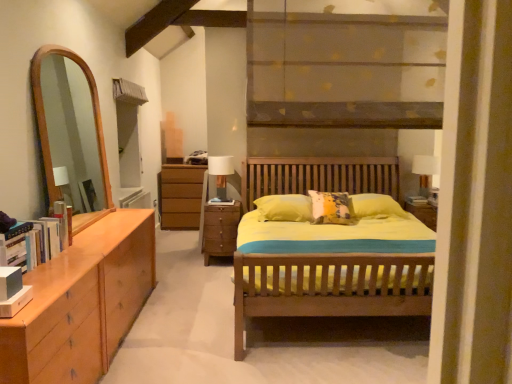
Describe the element at coordinates (220, 230) in the screenshot. The image size is (512, 384). I see `brown wooden chest of drawers at center` at that location.

Image resolution: width=512 pixels, height=384 pixels. Identify the location of brown wooden chest of drawers at center. (220, 230).

Can you tell me how much brown wooden chest of drawers at center and matte white table lamp at center, arranged as the second table lamp when viewed from the right, differ in facing direction?

They differ by 0.00233 degrees in their facing directions.

Is matte white table lamp at center, arranged as the second table lamp when viewed from the right, a part of brown wooden chest of drawers at center?

Definitely not — matte white table lamp at center, arranged as the second table lamp when viewed from the right, is not inside brown wooden chest of drawers at center.

Where is `table lamp that appears on the left of brown wooden chest of drawers at center`? This screenshot has width=512, height=384. table lamp that appears on the left of brown wooden chest of drawers at center is located at coordinates (221, 174).

Does point (240, 207) appear closer or farther from the camera than point (224, 164)?

Point (240, 207) is farther from the camera than point (224, 164).

Identify the location of table lamp that appears on the right of matte white table lamp at center, arranged as the second table lamp when viewed from the right. (425, 171).

Can you confirm if white glossy table lamp at right, placed as the first table lamp when sorted from right to left, is thinner than matte white table lamp at center, arranged as the second table lamp when viewed from the right?

Yes.

Between point (424, 186) and point (217, 166), which one is positioned behind?

Point (424, 186)

Are white glossy table lamp at right, placed as the first table lamp when sorted from right to left, and matte white table lamp at center, the first table lamp in the left-to-right sequence, located far from each other?

Absolutely, white glossy table lamp at right, placed as the first table lamp when sorted from right to left, is distant from matte white table lamp at center, the first table lamp in the left-to-right sequence.

Is matte white table lamp at center, the first table lamp in the left-to-right sequence, beside brown wooden chest of drawers at center?

No, matte white table lamp at center, the first table lamp in the left-to-right sequence, is not next to brown wooden chest of drawers at center.

Which object is thinner, matte white table lamp at center, arranged as the second table lamp when viewed from the right, or brown wooden chest of drawers at center?

With smaller width is matte white table lamp at center, arranged as the second table lamp when viewed from the right.

Considering the relative sizes of matte white table lamp at center, the first table lamp in the left-to-right sequence, and brown wooden chest of drawers at center in the image provided, is matte white table lamp at center, the first table lamp in the left-to-right sequence, smaller than brown wooden chest of drawers at center?

Indeed, matte white table lamp at center, the first table lamp in the left-to-right sequence, has a smaller size compared to brown wooden chest of drawers at center.

Considering the positions of points (208, 164) and (224, 233), is point (208, 164) farther from camera compared to point (224, 233)?

Yes, point (208, 164) is behind point (224, 233).

Considering the sizes of objects brown wooden chest of drawers at center and white glossy table lamp at right, positioned as the second table lamp in left-to-right order, in the image provided, who is bigger, brown wooden chest of drawers at center or white glossy table lamp at right, positioned as the second table lamp in left-to-right order,?

Bigger between the two is brown wooden chest of drawers at center.

Is brown wooden chest of drawers at center positioned with its back to white glossy table lamp at right, placed as the first table lamp when sorted from right to left?

brown wooden chest of drawers at center is not turned away from white glossy table lamp at right, placed as the first table lamp when sorted from right to left.

Is brown wooden chest of drawers at center not inside white glossy table lamp at right, positioned as the second table lamp in left-to-right order?

Absolutely, brown wooden chest of drawers at center is external to white glossy table lamp at right, positioned as the second table lamp in left-to-right order.

Is brown wooden chest of drawers at center in front of or behind white glossy table lamp at right, positioned as the second table lamp in left-to-right order, in the image?

Visually, brown wooden chest of drawers at center is located in front of white glossy table lamp at right, positioned as the second table lamp in left-to-right order.

Which point is more forward, (365, 40) or (217, 164)?

Positioned in front is point (365, 40).

From the picture: Is matte brown wooden shelf at upper center not near matte white table lamp at center, the first table lamp in the left-to-right sequence?

Yes, matte brown wooden shelf at upper center is far from matte white table lamp at center, the first table lamp in the left-to-right sequence.

Considering the sizes of objects matte brown wooden shelf at upper center and matte white table lamp at center, arranged as the second table lamp when viewed from the right, in the image provided, who is shorter, matte brown wooden shelf at upper center or matte white table lamp at center, arranged as the second table lamp when viewed from the right,?

matte white table lamp at center, arranged as the second table lamp when viewed from the right, is shorter.

From the picture: How many degrees apart are the facing directions of matte white table lamp at center, the first table lamp in the left-to-right sequence, and white glossy table lamp at right, placed as the first table lamp when sorted from right to left?

0.195 degrees.

Is matte white table lamp at center, arranged as the second table lamp when viewed from the right, looking in the opposite direction of white glossy table lamp at right, placed as the first table lamp when sorted from right to left?

No, matte white table lamp at center, arranged as the second table lamp when viewed from the right, is not facing away from white glossy table lamp at right, placed as the first table lamp when sorted from right to left.

Considering the sizes of objects matte white table lamp at center, arranged as the second table lamp when viewed from the right, and white glossy table lamp at right, placed as the first table lamp when sorted from right to left, in the image provided, who is bigger, matte white table lamp at center, arranged as the second table lamp when viewed from the right, or white glossy table lamp at right, placed as the first table lamp when sorted from right to left,?

matte white table lamp at center, arranged as the second table lamp when viewed from the right.

From the image's perspective, is matte white table lamp at center, the first table lamp in the left-to-right sequence, below white glossy table lamp at right, positioned as the second table lamp in left-to-right order?

No, from the image's perspective, matte white table lamp at center, the first table lamp in the left-to-right sequence, is not below white glossy table lamp at right, positioned as the second table lamp in left-to-right order.

From a real-world perspective, is brown wooden chest of drawers at center below matte brown wooden shelf at upper center?

Correct, in the physical world, brown wooden chest of drawers at center is lower than matte brown wooden shelf at upper center.

Considering the relative sizes of brown wooden chest of drawers at center and matte brown wooden shelf at upper center in the image provided, is brown wooden chest of drawers at center thinner than matte brown wooden shelf at upper center?

No.

Is brown wooden chest of drawers at center facing away from matte brown wooden shelf at upper center?

No.

Which is more to the left, brown wooden chest of drawers at center or matte brown wooden shelf at upper center?

brown wooden chest of drawers at center is more to the left.

This screenshot has height=384, width=512. In order to click on chest of drawers on the right of matte white table lamp at center, arranged as the second table lamp when viewed from the right in this screenshot , I will do `click(220, 230)`.

You are a GUI agent. You are given a task and a screenshot of the screen. Output one action in this format:
    pyautogui.click(x=<x>, y=<y>)
    Task: Click on the table lamp that appears behind the matte white table lamp at center, the first table lamp in the left-to-right sequence
    This screenshot has height=384, width=512.
    Given the screenshot: What is the action you would take?
    pyautogui.click(x=425, y=171)

Consider the image. Based on their spatial positions, is white glossy table lamp at right, placed as the first table lamp when sorted from right to left, or matte white table lamp at center, the first table lamp in the left-to-right sequence, closer to brown wooden chest of drawers at center?

matte white table lamp at center, the first table lamp in the left-to-right sequence.

From the image, which object appears to be farther from matte brown wooden shelf at upper center, white glossy table lamp at right, placed as the first table lamp when sorted from right to left, or brown wooden chest of drawers at center?

white glossy table lamp at right, placed as the first table lamp when sorted from right to left, is positioned further to the anchor matte brown wooden shelf at upper center.

Based on their spatial positions, is matte white table lamp at center, the first table lamp in the left-to-right sequence, or matte brown wooden shelf at upper center further from white glossy table lamp at right, positioned as the second table lamp in left-to-right order?

Based on the image, matte brown wooden shelf at upper center appears to be further to white glossy table lamp at right, positioned as the second table lamp in left-to-right order.

Based on the photo, from the image, which object appears to be nearer to white glossy table lamp at right, placed as the first table lamp when sorted from right to left, matte white table lamp at center, arranged as the second table lamp when viewed from the right, or brown wooden chest of drawers at center?

Based on the image, matte white table lamp at center, arranged as the second table lamp when viewed from the right, appears to be nearer to white glossy table lamp at right, placed as the first table lamp when sorted from right to left.

Based on their spatial positions, is white glossy table lamp at right, placed as the first table lamp when sorted from right to left, or matte brown wooden shelf at upper center closer to matte white table lamp at center, the first table lamp in the left-to-right sequence?

Among the two, matte brown wooden shelf at upper center is located nearer to matte white table lamp at center, the first table lamp in the left-to-right sequence.

Estimate the real-world distances between objects in this image. Which object is further from matte white table lamp at center, arranged as the second table lamp when viewed from the right, white glossy table lamp at right, placed as the first table lamp when sorted from right to left, or brown wooden chest of drawers at center?

white glossy table lamp at right, placed as the first table lamp when sorted from right to left.

When comparing their distances from white glossy table lamp at right, positioned as the second table lamp in left-to-right order, does brown wooden chest of drawers at center or matte white table lamp at center, arranged as the second table lamp when viewed from the right, seem closer?

Based on the image, matte white table lamp at center, arranged as the second table lamp when viewed from the right, appears to be nearer to white glossy table lamp at right, positioned as the second table lamp in left-to-right order.

Looking at this image, which object lies nearer to the anchor point matte brown wooden shelf at upper center, matte white table lamp at center, arranged as the second table lamp when viewed from the right, or white glossy table lamp at right, placed as the first table lamp when sorted from right to left?

matte white table lamp at center, arranged as the second table lamp when viewed from the right, is closer to matte brown wooden shelf at upper center.

In order to click on the chest of drawers positioned between matte brown wooden shelf at upper center and matte white table lamp at center, the first table lamp in the left-to-right sequence, from near to far in this screenshot , I will do `click(220, 230)`.

Where is `chest of drawers between matte brown wooden shelf at upper center and white glossy table lamp at right, positioned as the second table lamp in left-to-right order, in the front-back direction`? chest of drawers between matte brown wooden shelf at upper center and white glossy table lamp at right, positioned as the second table lamp in left-to-right order, in the front-back direction is located at coordinates (220, 230).

The height and width of the screenshot is (384, 512). I want to click on table lamp between matte brown wooden shelf at upper center and white glossy table lamp at right, positioned as the second table lamp in left-to-right order, in the front-back direction, so click(221, 174).

Find the location of a particular element. The image size is (512, 384). the chest of drawers located between matte white table lamp at center, the first table lamp in the left-to-right sequence, and white glossy table lamp at right, placed as the first table lamp when sorted from right to left, in the left-right direction is located at coordinates (220, 230).